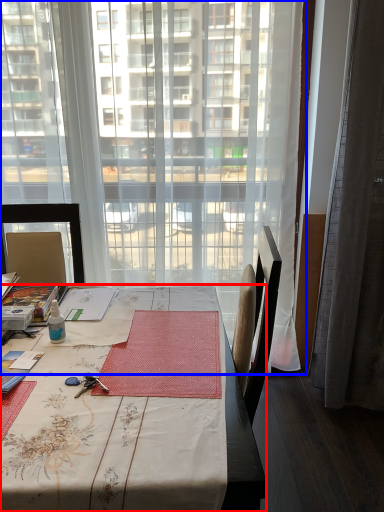
Question: Which object appears closest to the camera in this image, desk (highlighted by a red box) or window (highlighted by a blue box)?

Choices:
 (A) desk
 (B) window

Answer: (A)